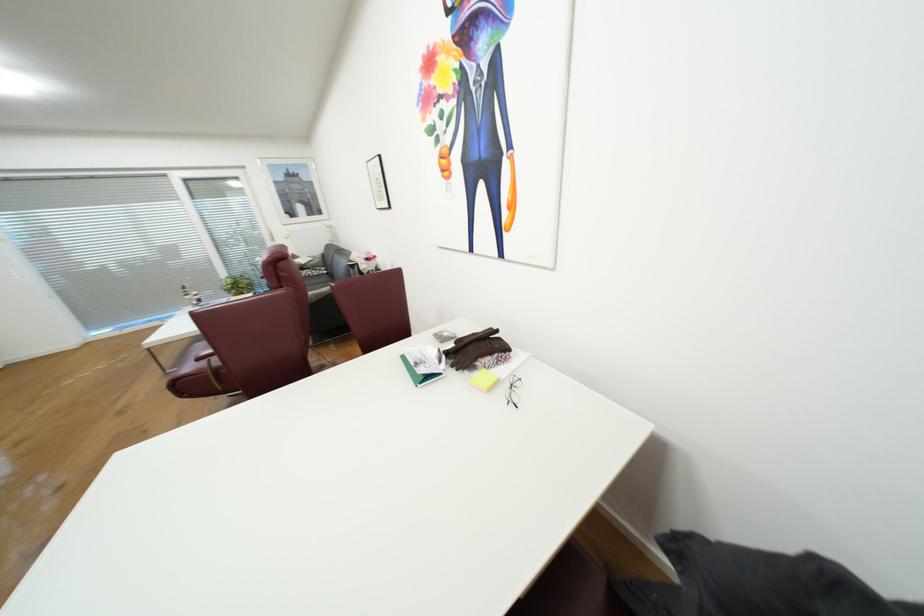
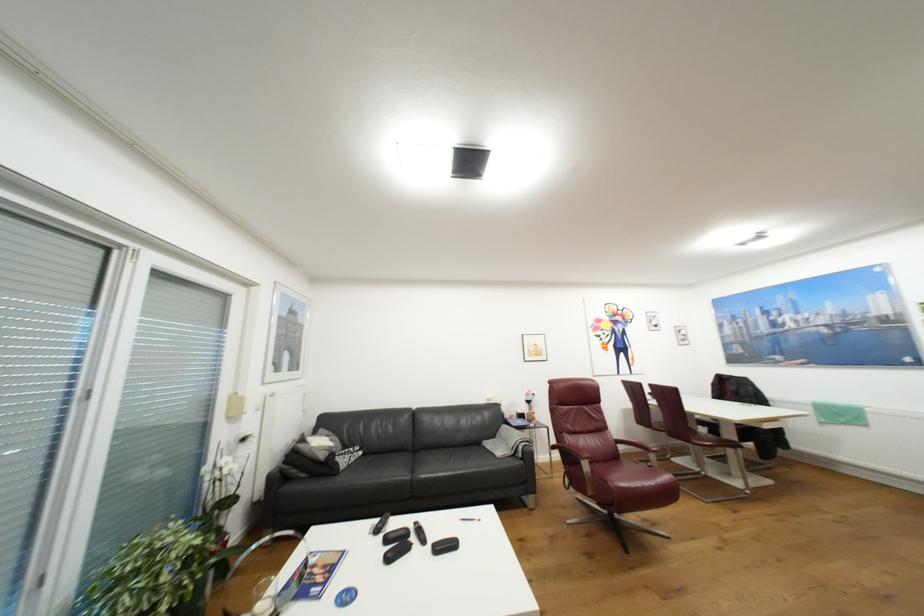
Question: I am providing you with two images of the same scene from different viewpoints. Please identify which objects are invisible in image2.

Choices:
 (A) pair of eyeglasses
 (B) yellow valve handle
 (C) black sofa sitting surface
 (D) blue circular lid

Answer: (A)